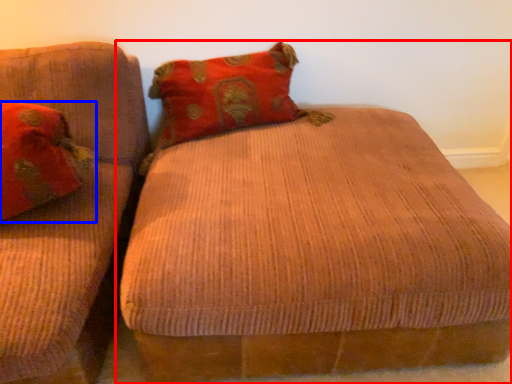
Question: Which of the following is the closest to the observer, studio couch (highlighted by a red box) or pillow (highlighted by a blue box)?

Choices:
 (A) studio couch
 (B) pillow

Answer: (A)